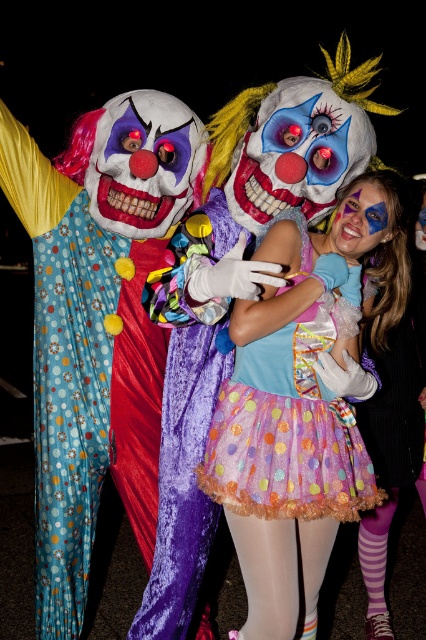
Question: Which of the following is the farthest from the observer?

Choices:
 (A) (236, 397)
 (B) (155, 266)

Answer: (B)

Question: Is polka dot fabric clown at left thinner than pastel polka dot tutu at center?

Choices:
 (A) yes
 (B) no

Answer: (B)

Question: Considering the relative positions of polka dot fabric clown at left and pastel polka dot tutu at center in the image provided, where is polka dot fabric clown at left located with respect to pastel polka dot tutu at center?

Choices:
 (A) below
 (B) above

Answer: (B)

Question: Which point is farther to the camera?

Choices:
 (A) (85, 600)
 (B) (241, 369)

Answer: (A)

Question: Where is polka dot fabric clown at left located in relation to pastel polka dot tutu at center in the image?

Choices:
 (A) above
 (B) below

Answer: (A)